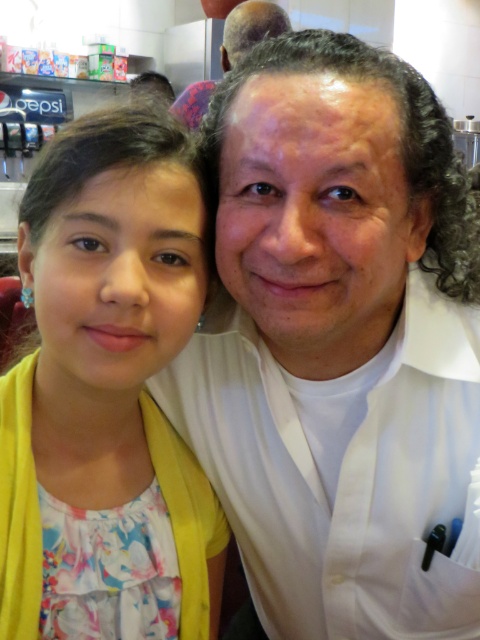
Question: Which is nearer to the matte black hair at upper center?

Choices:
 (A) white smooth shirt at center
 (B) floral fabric dress at left

Answer: (A)

Question: Can you confirm if floral fabric dress at left is wider than matte black hair at upper center?

Choices:
 (A) yes
 (B) no

Answer: (B)

Question: In this image, where is white smooth shirt at center located relative to matte black hair at upper center?

Choices:
 (A) left
 (B) right

Answer: (B)

Question: Among these points, which one is farthest from the camera?

Choices:
 (A) (173, 193)
 (B) (216, 220)

Answer: (B)

Question: Does white smooth shirt at center have a lesser width compared to floral fabric dress at left?

Choices:
 (A) yes
 (B) no

Answer: (B)

Question: Among these objects, which one is farthest from the camera?

Choices:
 (A) floral fabric dress at left
 (B) matte black hair at upper center

Answer: (B)